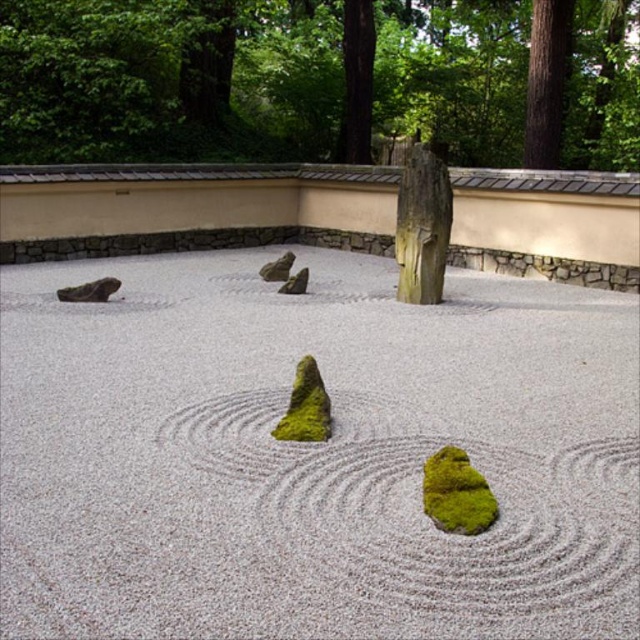
You are a gardener planning to place a new decorative stone in the Japanese Zen garden. The stone you have is larger than the white gravel at center but smaller than the green mossy rock at center. Where could you place the new stone so it fits appropriately in size compared to the existing elements?

The new stone should be placed between the white gravel at center and the green mossy rock at center since it is larger than the white gravel at center but smaller than the green mossy rock at center.

You are a gardener who needs to place a new decorative statue that is 1 foot tall. You want to place it in the garden so that it is taller than the white gravel at center but shorter than the green mossy rock at center. Is this possible?

The white gravel at center is not as tall as the green mossy rock at center. Since the statue is 1 foot tall, it can be placed to be taller than the white gravel at center but shorter than the green mossy rock at center if the green mossy rock at center is taller than 1 foot. However, without knowing the exact height of the green mossy rock at center, it is impossible to determine definitively.

You are a gardener maintaining a Japanese Zen garden. You notice the white gravel at center and the green mossy rock at center. Which object is directly above the other?

The green mossy rock at center is directly above the white gravel at center because the white gravel at center is positioned under it.